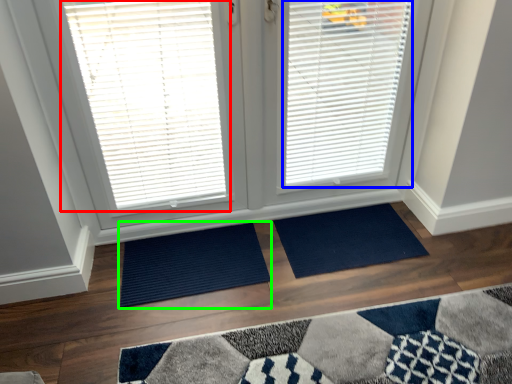
Question: Based on their relative distances, which object is nearer to window blind (highlighted by a red box)? Choose from window blind (highlighted by a blue box) and doormat (highlighted by a green box).

Choices:
 (A) window blind
 (B) doormat

Answer: (A)